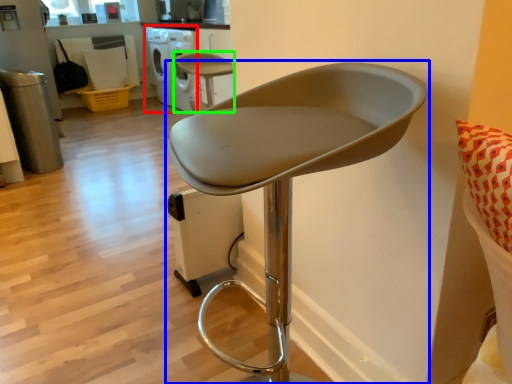
Question: Estimate the real-world distances between objects in this image. Which object is closer to dish washer (highlighted by a red box), chair (highlighted by a blue box) or chair (highlighted by a green box)?

Choices:
 (A) chair
 (B) chair

Answer: (B)